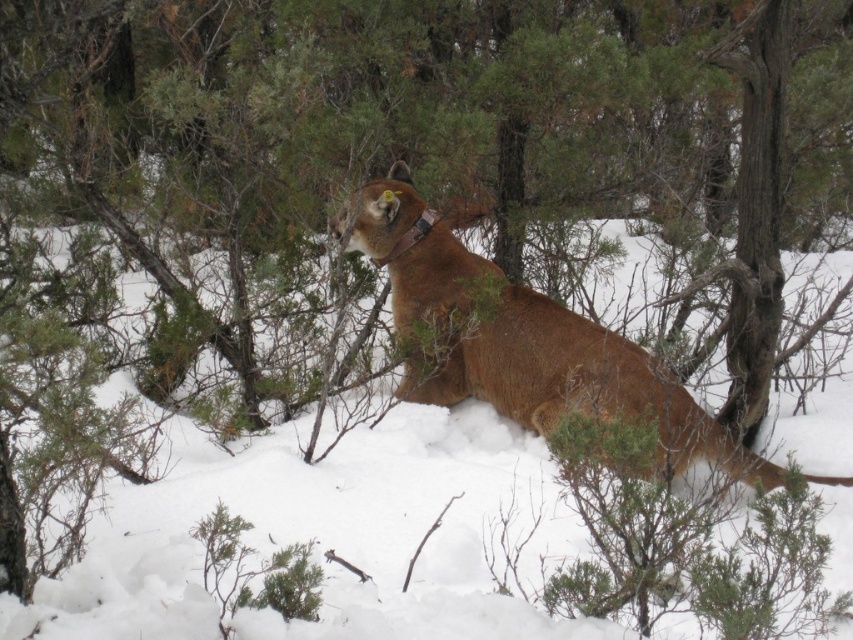
In the scene shown: You are a hiker lost in a snowy forest. You see a mountain lion and a green leafy tree. According to the map coordinates, the point at [419,136] marks the location of the green leafy tree. If you are standing at the mountain lion, which direction should you go to reach the green leafy tree?

The point at [419,136] marks the green leafy tree at center, so if you are at the mountain lion, you should go straight ahead to reach the green leafy tree at center.